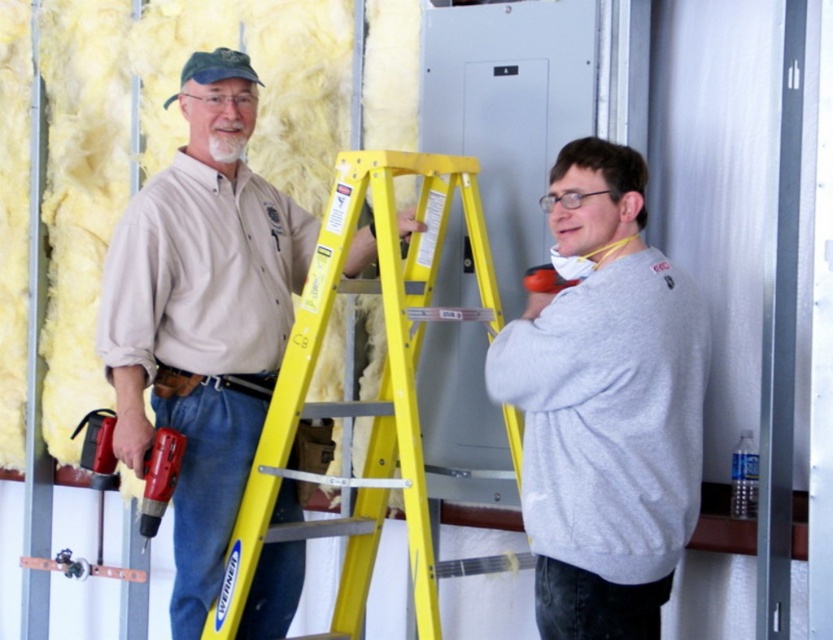
Looking at this image, based on the scene described, which clothing item, the gray cotton sweatshirt at right or the matte khaki shirt at center, is shorter in height?

The gray cotton sweatshirt at right has a lesser height compared to the matte khaki shirt at center, so the gray cotton sweatshirt at right is shorter in height.

Based on the photo, you are a construction worker standing at the point marked as point (x=605, y=404) in the image. You need to hand over a safety checklist to your colleague who is wearing a gray cotton sweatshirt at right. Can you directly hand it to them without moving from your current position?

The point (x=605, y=404) corresponds to the gray cotton sweatshirt at right, so you are already at the location of the gray cotton sweatshirt at right. Therefore, you can hand over the safety checklist directly to your colleague without moving.

Based on the photo, you are standing in the construction area and need to determine which of the two points, point (669, 458) or point (549, 276), is nearer to you. Based on the scene, which point is closer?

Point (669, 458) is closer to the viewer than point (549, 276).